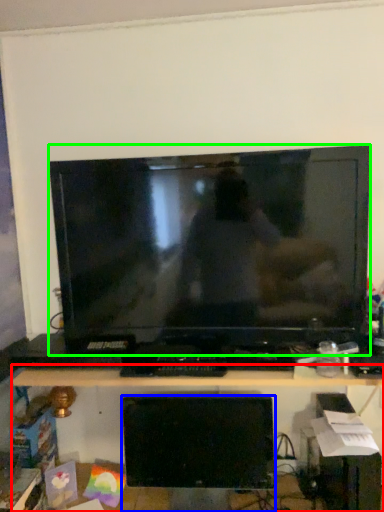
Question: Which object is positioned closest to desk (highlighted by a red box)? Select from computer monitor (highlighted by a blue box) and television (highlighted by a green box).

Choices:
 (A) computer monitor
 (B) television

Answer: (A)